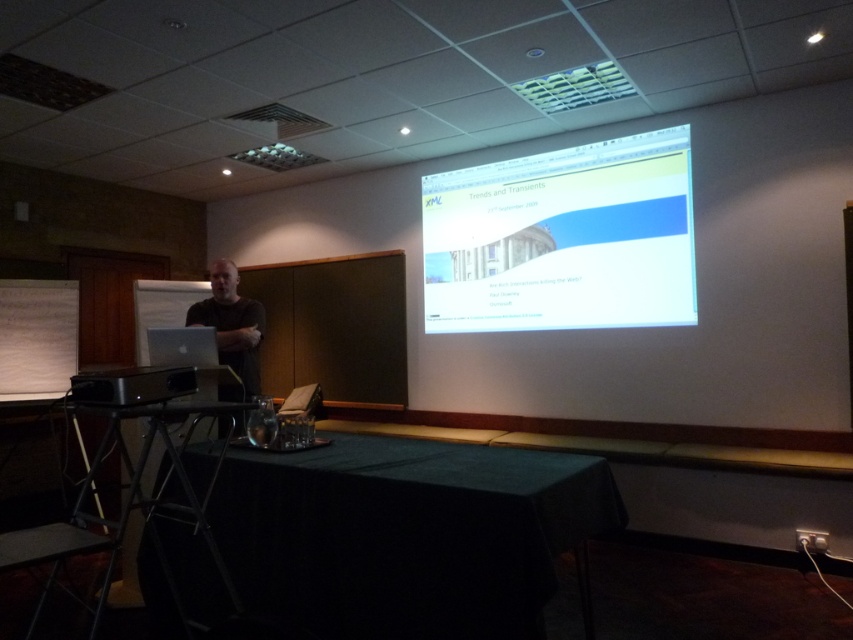
You are sitting in the conference hall and notice both the white glossy projector screen at upper center and the black matte shirt at center. From your perspective, which object is positioned to the right side?

The white glossy projector screen at upper center is to the right of the black matte shirt at center.

You are an event organizer standing in the conference hall. You need to place a name tag on the table for a speaker. The name tag is 10 cm wide. Can you fit it on the black metal table at center without overlapping the black matte shirt at center?

The black metal table at center is positioned on the left side of black matte shirt at center, so there is space to place the name tag on the left side of the black matte shirt at center without overlapping it. The name tag should fit as long as it stays within that area.

In the scene shown: You are organizing a presentation in the conference hall and need to place a name tag on the table. Where should you place it so that it is centered relative to the black matte shirt at center?

The black matte shirt at center is located at point (231, 323), so placing the name tag at the same coordinates would center it relative to the shirt.